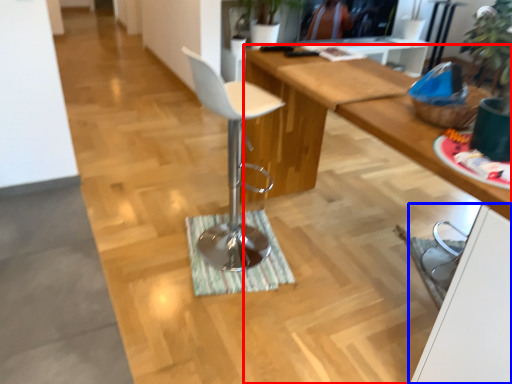
Question: Which of the following is the farthest to the observer, desk (highlighted by a red box) or cabinetry (highlighted by a blue box)?

Choices:
 (A) desk
 (B) cabinetry

Answer: (A)